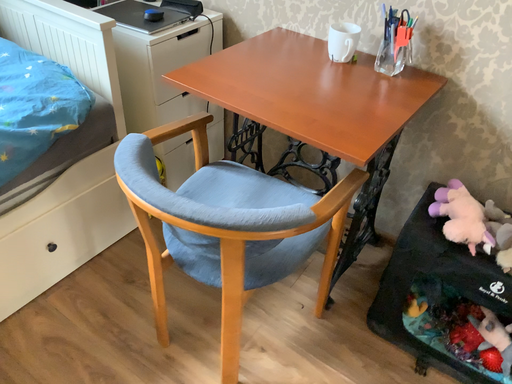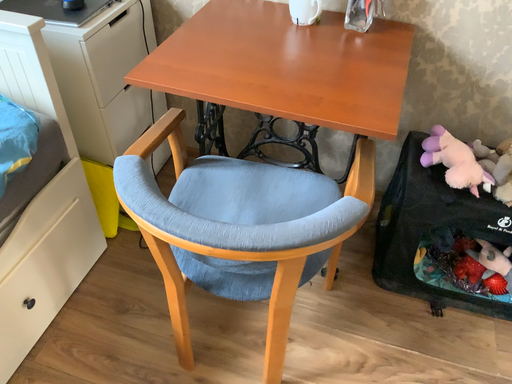
Question: How did the camera likely rotate when shooting the video?

Choices:
 (A) rotated left
 (B) rotated right

Answer: (B)